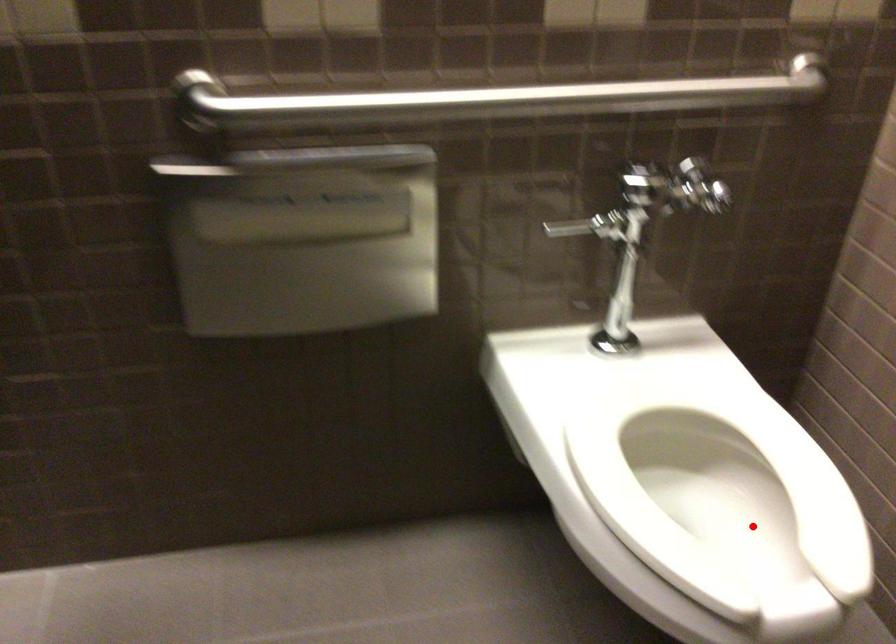
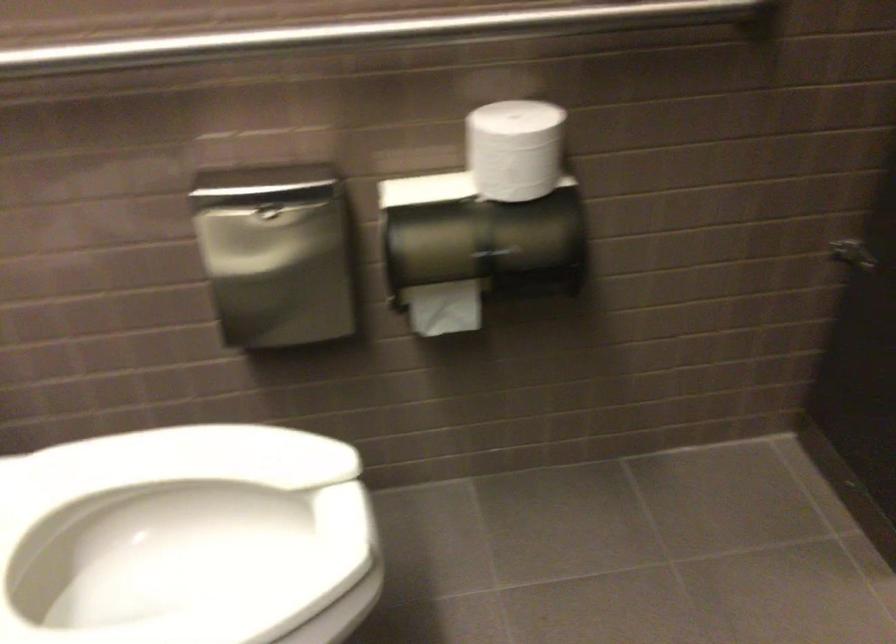
In the second image, find the point that corresponds to the highlighted location in the first image.

(186, 538)